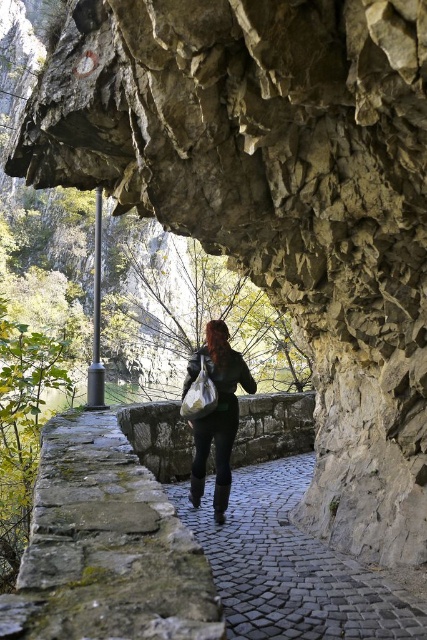
Based on the photo, you are a hiker who wants to know the distance between the black cobblestone path at center and the matte white plastic bag at center. Can you tell me which one is closer to me?

The black cobblestone path at center is shorter than matte white plastic bag at center, so the black cobblestone path at center is closer to you.